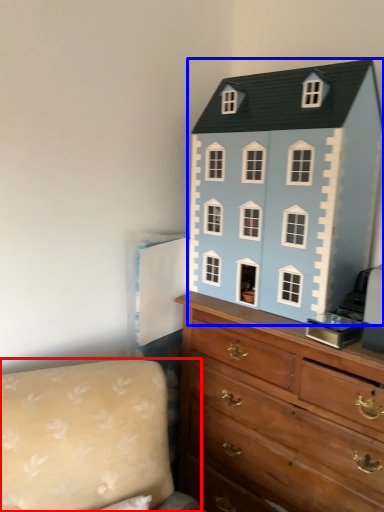
Question: Which point is closer to the camera, couch (highlighted by a red box) or toy (highlighted by a blue box)?

Choices:
 (A) couch
 (B) toy

Answer: (A)